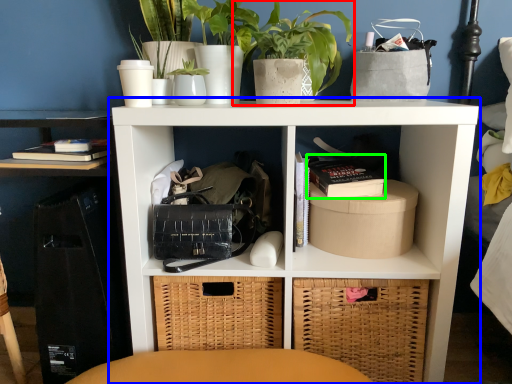
Question: Which object is the farthest from houseplant (highlighted by a red box)? Choose among these: shelf (highlighted by a blue box) or book (highlighted by a green box).

Choices:
 (A) shelf
 (B) book

Answer: (B)